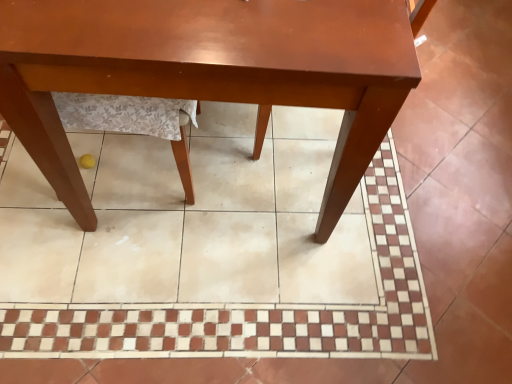
Question: From their relative heights in the image, would you say matte wood table at center is taller or shorter than brown glossy tile at center?

Choices:
 (A) tall
 (B) short

Answer: (A)

Question: Looking at their shapes, would you say matte wood table at center is wider or thinner than brown glossy tile at center?

Choices:
 (A) wide
 (B) thin

Answer: (B)

Question: From the image's perspective, is matte wood table at center positioned above or below brown glossy tile at center?

Choices:
 (A) above
 (B) below

Answer: (A)

Question: In the image, is brown glossy tile at center positioned in front of or behind matte wood table at center?

Choices:
 (A) front
 (B) behind

Answer: (B)

Question: Would you say brown glossy tile at center is inside or outside matte wood table at center?

Choices:
 (A) outside
 (B) inside

Answer: (A)

Question: In terms of height, does brown glossy tile at center look taller or shorter compared to matte wood table at center?

Choices:
 (A) tall
 (B) short

Answer: (B)

Question: From a real-world perspective, is brown glossy tile at center physically located above or below matte wood table at center?

Choices:
 (A) below
 (B) above

Answer: (A)